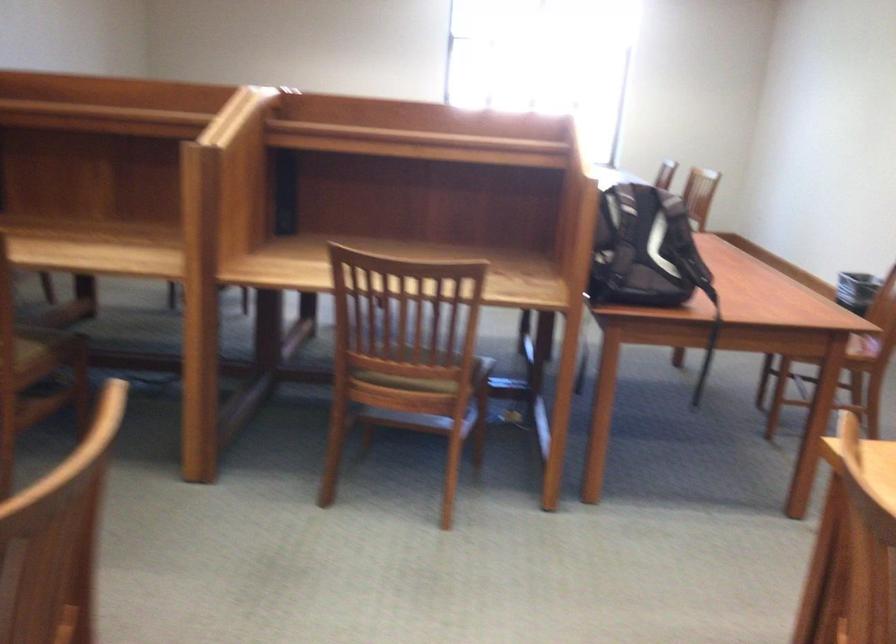
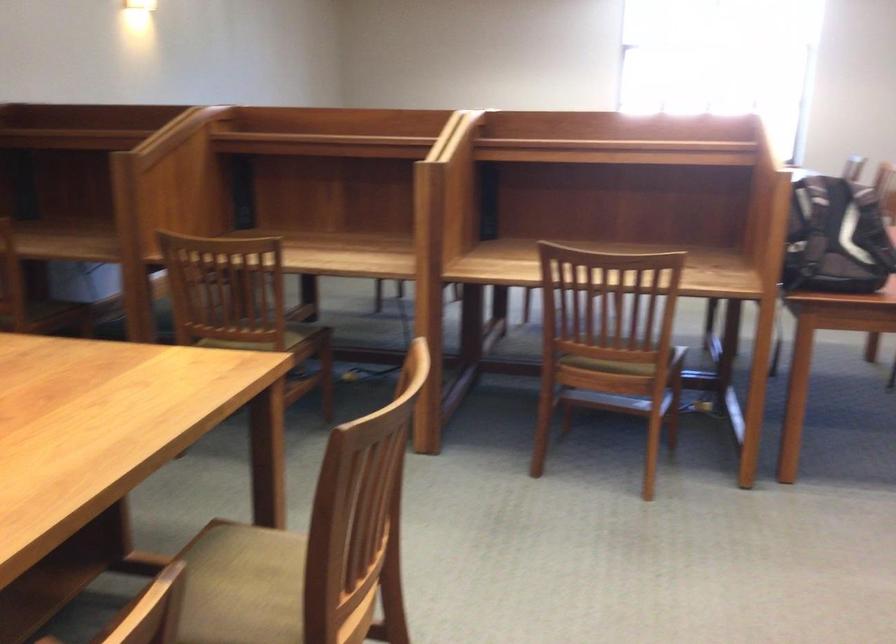
Question: The first image is from the beginning of the video and the second image is from the end. How did the camera likely rotate when shooting the video?

Choices:
 (A) Left
 (B) Right
 (C) Up
 (D) Down

Answer: (A)